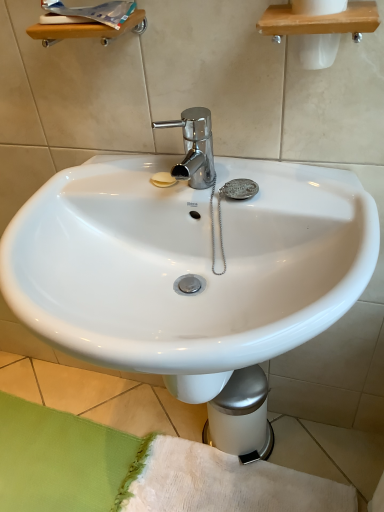
What do you see at coordinates (187, 265) in the screenshot?
I see `white glossy sink at center` at bounding box center [187, 265].

Measure the distance between white glossy sink at center and camera.

18.70 inches.

You are a GUI agent. You are given a task and a screenshot of the screen. Output one action in this format:
    pyautogui.click(x=<x>, y=<y>)
    Task: Click on the white glossy sink at center
    
    Given the screenshot: What is the action you would take?
    [x=187, y=265]

What do you see at coordinates (138, 471) in the screenshot? The height and width of the screenshot is (512, 384). I see `green fabric bath mat at lower left` at bounding box center [138, 471].

Identify the location of green fabric bath mat at lower left. (138, 471).

Find the location of a particular element. The height and width of the screenshot is (512, 384). white glossy sink at center is located at coordinates (187, 265).

From the picture: Is green fabric bath mat at lower left to the left of white glossy sink at center from the viewer's perspective?

Yes.

Relative to white glossy sink at center, is green fabric bath mat at lower left in front or behind?

green fabric bath mat at lower left is behind white glossy sink at center.

Which is less distant, (218,455) or (54,265)?

Point (218,455) is farther from the camera than point (54,265).

From the image's perspective, between green fabric bath mat at lower left and white glossy sink at center, who is located below?

green fabric bath mat at lower left appears lower in the image.

From a real-world perspective, is green fabric bath mat at lower left positioned above or below white glossy sink at center?

From a real-world perspective, green fabric bath mat at lower left is physically below white glossy sink at center.

Which of these two, green fabric bath mat at lower left or white glossy sink at center, is thinner?

white glossy sink at center.

Considering the relative sizes of green fabric bath mat at lower left and white glossy sink at center in the image provided, is green fabric bath mat at lower left taller than white glossy sink at center?

No, green fabric bath mat at lower left is not taller than white glossy sink at center.

Considering the sizes of objects green fabric bath mat at lower left and white glossy sink at center in the image provided, who is bigger, green fabric bath mat at lower left or white glossy sink at center?

white glossy sink at center.

Would you say green fabric bath mat at lower left is inside or outside white glossy sink at center?

green fabric bath mat at lower left is outside white glossy sink at center.

Is green fabric bath mat at lower left placed right next to white glossy sink at center?

They are not placed beside each other.

Is white glossy sink at center at the back of green fabric bath mat at lower left?

No, white glossy sink at center is not at the back of green fabric bath mat at lower left.

What's the angular difference between green fabric bath mat at lower left and white glossy sink at center's facing directions?

The angular difference between green fabric bath mat at lower left and white glossy sink at center is 90.3 degrees.

Identify the location of bath mat located below the white glossy sink at center (from the image's perspective). (138, 471).

Consider the image. Is white glossy sink at center at the left side of green fabric bath mat at lower left?

No.

Which object is more forward, white glossy sink at center or green fabric bath mat at lower left?

white glossy sink at center is closer to the camera.

Is point (98, 304) closer to camera compared to point (297, 484)?

Yes, point (98, 304) is closer to viewer.

From the image's perspective, is white glossy sink at center on top of green fabric bath mat at lower left?

Yes.

From a real-world perspective, which is physically below, white glossy sink at center or green fabric bath mat at lower left?

In real-world perspective, green fabric bath mat at lower left is lower.

Which object is thinner, white glossy sink at center or green fabric bath mat at lower left?

white glossy sink at center is thinner.

Does white glossy sink at center have a greater height compared to green fabric bath mat at lower left?

Yes.

Can you confirm if white glossy sink at center is bigger than green fabric bath mat at lower left?

Yes.

Is white glossy sink at center spatially inside green fabric bath mat at lower left, or outside of it?

white glossy sink at center cannot be found inside green fabric bath mat at lower left.

Looking at this image, are white glossy sink at center and green fabric bath mat at lower left making contact?

They are not placed beside each other.

Could you tell me if white glossy sink at center is facing green fabric bath mat at lower left?

No, white glossy sink at center is not oriented towards green fabric bath mat at lower left.

Image resolution: width=384 pixels, height=512 pixels. In order to click on sink in front of the green fabric bath mat at lower left in this screenshot , I will do `click(187, 265)`.

The height and width of the screenshot is (512, 384). What are the coordinates of `bath mat to the left of white glossy sink at center` in the screenshot? It's located at (138, 471).

Locate an element on the screen. The width and height of the screenshot is (384, 512). sink above the green fabric bath mat at lower left (from the image's perspective) is located at coordinates (187, 265).